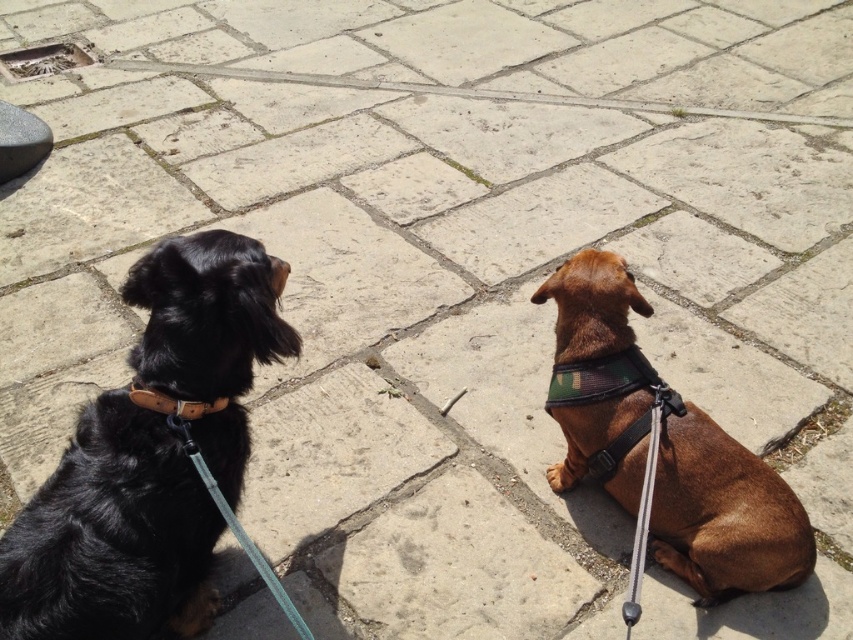
Who is more distant from viewer, (218, 348) or (741, 544)?

The point (741, 544) is more distant.

Is point (167, 474) closer to viewer compared to point (747, 529)?

Yes, it is in front of point (747, 529).

Find the location of a particular element. This screenshot has width=853, height=640. black leather collar at left is located at coordinates (112, 536).

At what (x,y) coordinates should I click in order to perform the action: click on black leather collar at left. Please return your answer as a coordinate pair (x, y). Looking at the image, I should click on (112, 536).

Is black leather collar at left shorter than teal fabric leash at lower left?

In fact, black leather collar at left may be taller than teal fabric leash at lower left.

Is point (187, 502) positioned in front of point (212, 480)?

That is False.

Image resolution: width=853 pixels, height=640 pixels. What are the coordinates of `black leather collar at left` in the screenshot? It's located at (112, 536).

Does brown matte harness at right appear over leather/camel at left?

No, brown matte harness at right is not above leather/camel at left.

Can you confirm if brown matte harness at right is shorter than leather/camel at left?

No, brown matte harness at right is not shorter than leather/camel at left.

Between point (569, 460) and point (181, 401), which one is positioned in front?

Positioned in front is point (181, 401).

Where is `brown matte harness at right`? Image resolution: width=853 pixels, height=640 pixels. brown matte harness at right is located at coordinates (723, 513).